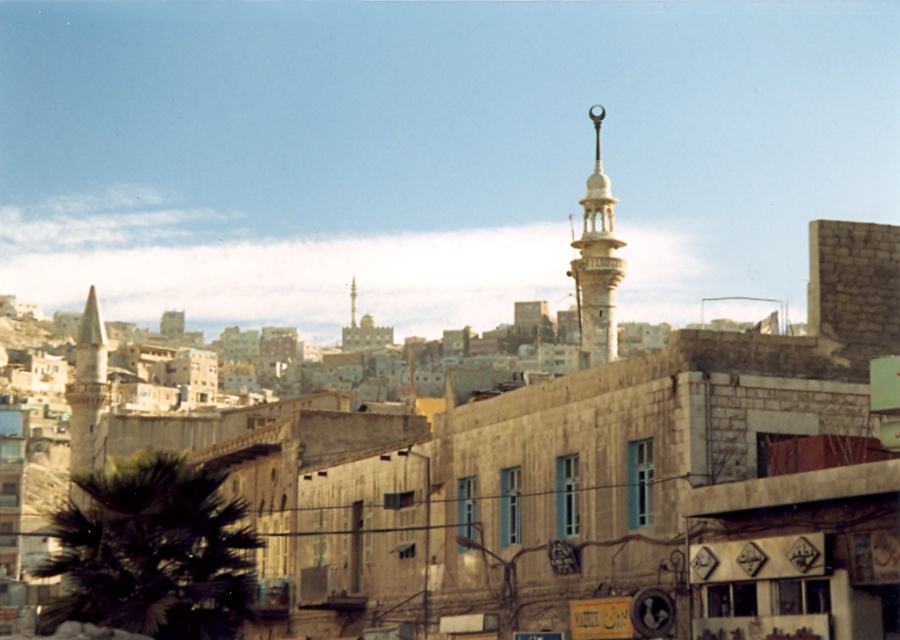
Between white stone minaret at center and stone tower at left, which one has more height?

white stone minaret at center

Which is behind, point (587, 321) or point (79, 444)?

Positioned behind is point (587, 321).

Locate an element on the screen. Image resolution: width=900 pixels, height=640 pixels. white stone minaret at center is located at coordinates (596, 262).

Is dark green leafy palm tree at lower left taller than white stone minaret at center?

No.

Can you confirm if dark green leafy palm tree at lower left is thinner than white stone minaret at center?

Correct, dark green leafy palm tree at lower left's width is less than white stone minaret at center's.

The width and height of the screenshot is (900, 640). Describe the element at coordinates (153, 552) in the screenshot. I see `dark green leafy palm tree at lower left` at that location.

Where is `dark green leafy palm tree at lower left`? dark green leafy palm tree at lower left is located at coordinates (153, 552).

Which is behind, point (181, 634) or point (97, 355)?

The point (97, 355) is behind.

Is dark green leafy palm tree at lower left thinner than stone tower at left?

Indeed, dark green leafy palm tree at lower left has a lesser width compared to stone tower at left.

Which is in front, point (122, 589) or point (88, 296)?

Positioned in front is point (122, 589).

The image size is (900, 640). What are the coordinates of `dark green leafy palm tree at lower left` in the screenshot? It's located at (153, 552).